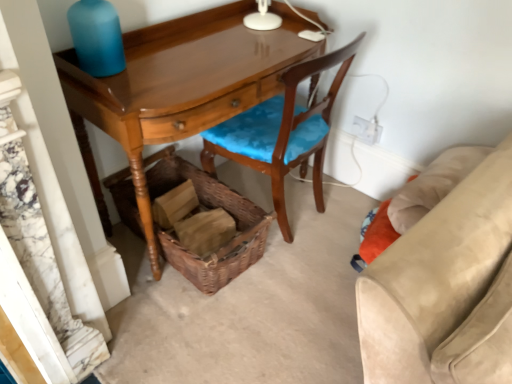
Question: Is point (122, 114) positioned closer to the camera than point (506, 253)?

Choices:
 (A) farther
 (B) closer

Answer: (A)

Question: Considering the relative positions of glossy wood desk at center and suede beige couch at lower right in the image provided, is glossy wood desk at center to the left or to the right of suede beige couch at lower right?

Choices:
 (A) right
 (B) left

Answer: (B)

Question: Based on their relative distances, which object is nearer to the blue matte bottle at upper left?

Choices:
 (A) white plastic power outlet at upper right
 (B) suede beige couch at lower right
 (C) woven brown picnic basket at lower center
 (D) wooden chair with blue cushion at center
 (E) glossy wood desk at center

Answer: (E)

Question: Estimate the real-world distances between objects in this image. Which object is farther from the woven brown picnic basket at lower center?

Choices:
 (A) wooden chair with blue cushion at center
 (B) glossy wood desk at center
 (C) blue matte bottle at upper left
 (D) suede beige couch at lower right
 (E) white plastic power outlet at upper right

Answer: (D)